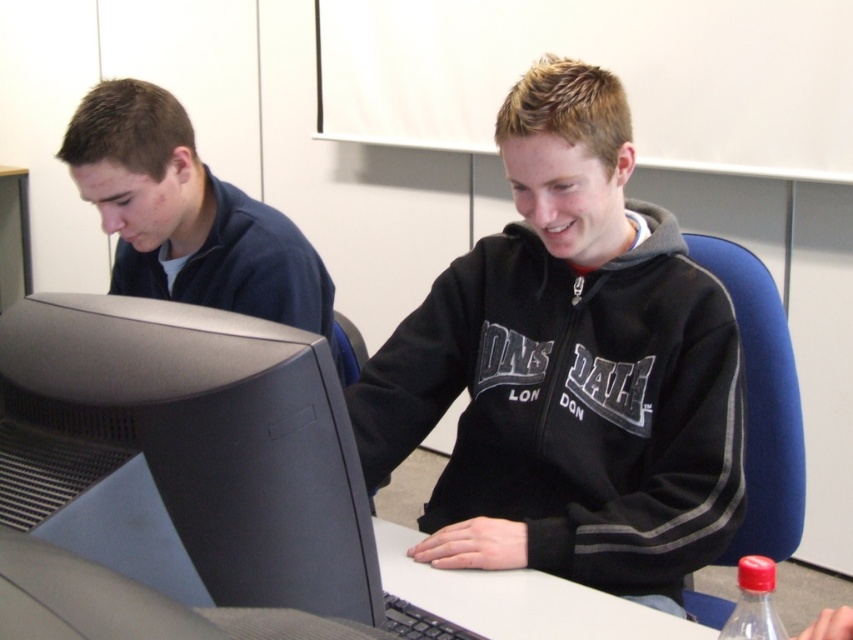
In the scene shown: You are a tailor who needs to determine which garment requires more fabric for alterations. Based on the scene, which item between the black fleece sweatshirt at center and the matte blue shirt at left needs more fabric due to its larger size?

The black fleece sweatshirt at center requires more fabric because it is wider than the matte blue shirt at left.

From the picture: You are a photographer taking a picture of the scene. You want to focus on the black matte computer monitor at left and the red plastic bottle at lower right. Which object should you adjust your camera focus on first to ensure both are in focus?

The black matte computer monitor at left is closer to the viewer than the red plastic bottle at lower right. To ensure both are in focus, you should focus on the black matte computer monitor at left first, as it is closer and adjusting focus from near to far can help capture both objects within the depth of field.

You are a delivery robot with a package that is 24 inches long. You need to place it between the black matte computer monitor at left and the red plastic bottle at lower right. Is there enough space for the package?

The distance between the black matte computer monitor at left and the red plastic bottle at lower right is 22.55 inches. Since the package is 24 inches long, it is longer than the available space, so the package cannot fit between them.